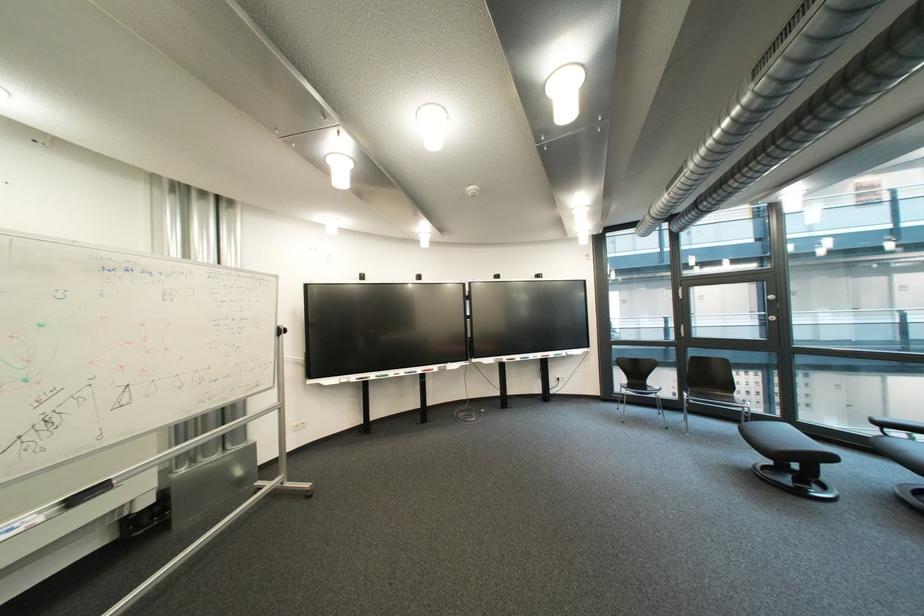
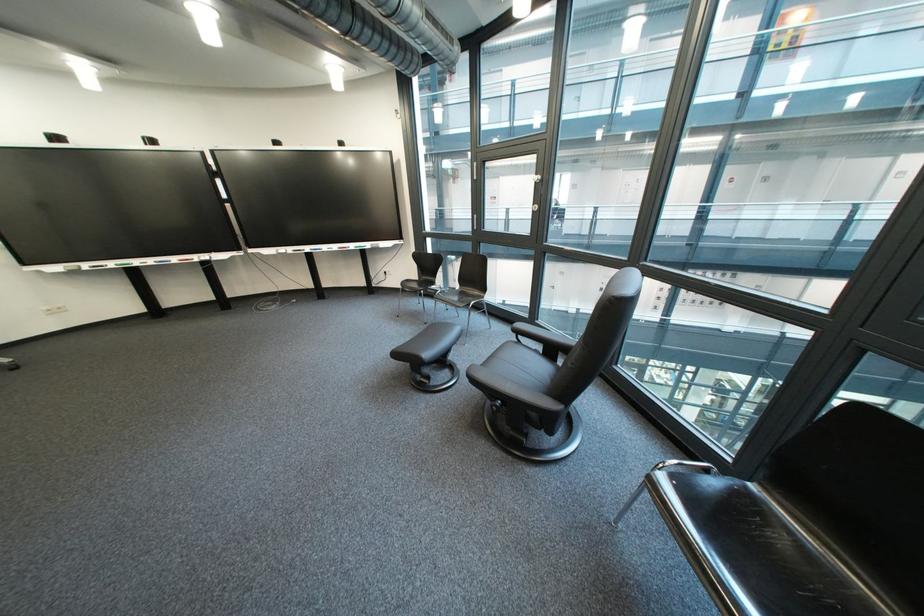
The point at (419,374) is marked in the first image. Where is the corresponding point in the second image?

(169, 264)